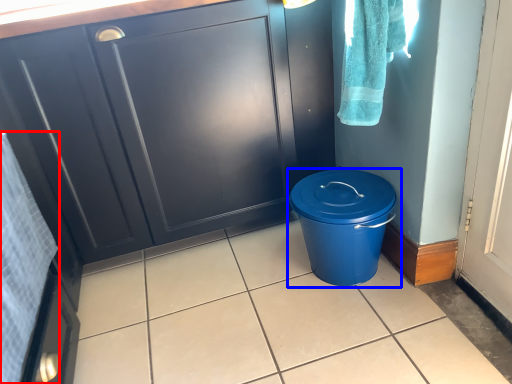
Question: Which point is further to the camera, bath towel (highlighted by a red box) or waste container (highlighted by a blue box)?

Choices:
 (A) bath towel
 (B) waste container

Answer: (B)